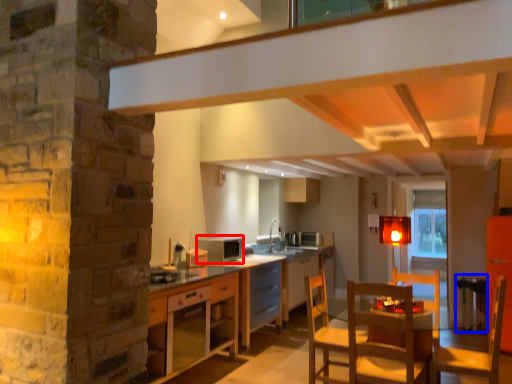
Question: Which object appears farthest to the camera in this image, appliance (highlighted by a red box) or bar stool (highlighted by a blue box)?

Choices:
 (A) appliance
 (B) bar stool

Answer: (B)